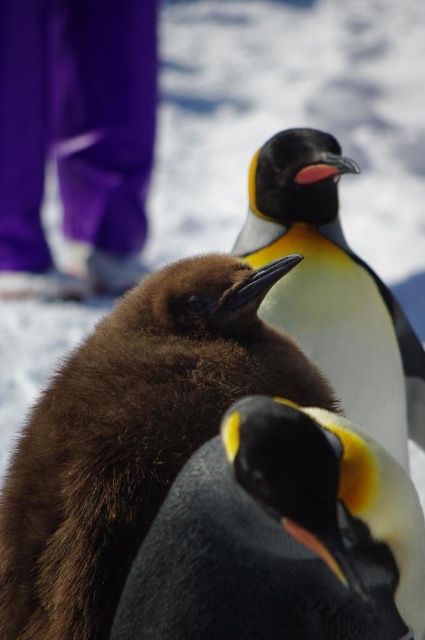
You are a researcher observing penguins in their habitat. You notice a point marked at coordinates [132,435] in your camera viewfinder. Based on the scene, what animal is located at that point?

The point at [132,435] corresponds to the brown fuzzy penguin at center.

You are a wildlife photographer trying to capture a photo of the black matte penguin at center and the black and white feathers at center. Based on their sizes, which one should you focus on if you want to ensure both are fully visible in the frame without cropping?

The black matte penguin at center is not as tall as black and white feathers at center, so you should focus on the taller black and white feathers at center to ensure both fit in the frame.